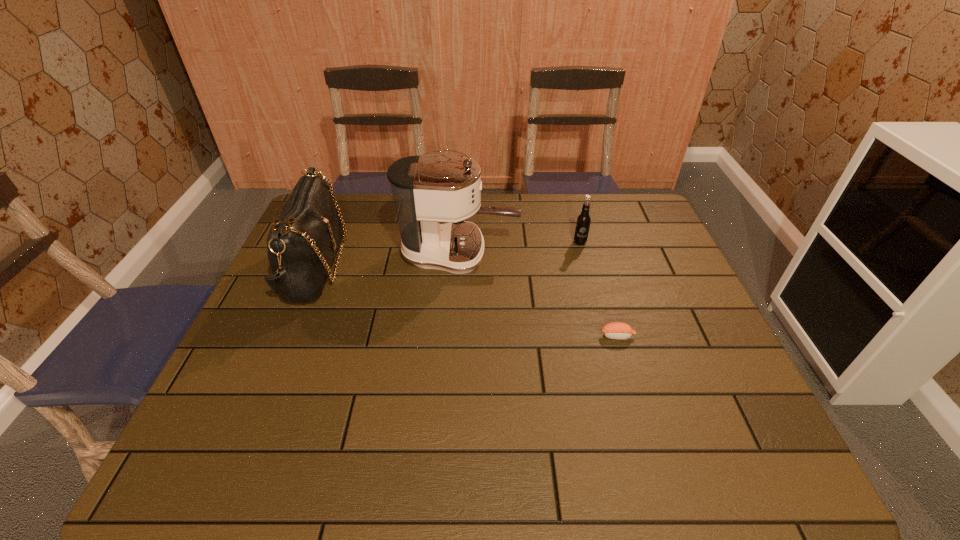
This screenshot has width=960, height=540. Identify the location of free space that satisfies the following two spatial constraints: 1. on the label of the root beer; 2. at the front of the leftmost object with chain and zipper. (587, 267).

Image resolution: width=960 pixels, height=540 pixels. Find the location of `vacant space that satisfies the following two spatial constraints: 1. on the label of the shortest object; 2. on the right side of the third tallest object`. vacant space that satisfies the following two spatial constraints: 1. on the label of the shortest object; 2. on the right side of the third tallest object is located at coordinates (606, 336).

This screenshot has width=960, height=540. Find the location of `vacant space that satisfies the following two spatial constraints: 1. on the label of the shortest object; 2. on the left side of the root beer`. vacant space that satisfies the following two spatial constraints: 1. on the label of the shortest object; 2. on the left side of the root beer is located at coordinates (606, 336).

This screenshot has height=540, width=960. In order to click on free region that satisfies the following two spatial constraints: 1. at the front of the sushi with chain and zipper; 2. on the right side of the leftmost object in this screenshot , I will do `click(285, 336)`.

You are a GUI agent. You are given a task and a screenshot of the screen. Output one action in this format:
    pyautogui.click(x=<x>, y=<y>)
    Task: Click on the vacant area that satisfies the following two spatial constraints: 1. on the back side of the nearest object; 2. at the front of the handbag with chain and zipper
    This screenshot has height=540, width=960.
    Given the screenshot: What is the action you would take?
    pyautogui.click(x=597, y=267)

Locate an element on the screen. Image resolution: width=960 pixels, height=540 pixels. vacant space that satisfies the following two spatial constraints: 1. on the label of the sushi; 2. on the right side of the root beer is located at coordinates (606, 336).

The width and height of the screenshot is (960, 540). Identify the location of free location that satisfies the following two spatial constraints: 1. on the label of the root beer; 2. at the front of the leftmost object with chain and zipper. (587, 267).

Locate an element on the screen. Image resolution: width=960 pixels, height=540 pixels. vacant area that satisfies the following two spatial constraints: 1. on the back side of the nearest object; 2. at the front of the third shortest object with chain and zipper is located at coordinates (597, 267).

Identify the location of vacant space that satisfies the following two spatial constraints: 1. on the front-facing side of the tallest object; 2. on the right side of the shortest object. (454, 336).

This screenshot has height=540, width=960. In order to click on vacant area that satisfies the following two spatial constraints: 1. on the front-facing side of the sushi; 2. on the left side of the second object from left to right in this screenshot , I will do `click(454, 336)`.